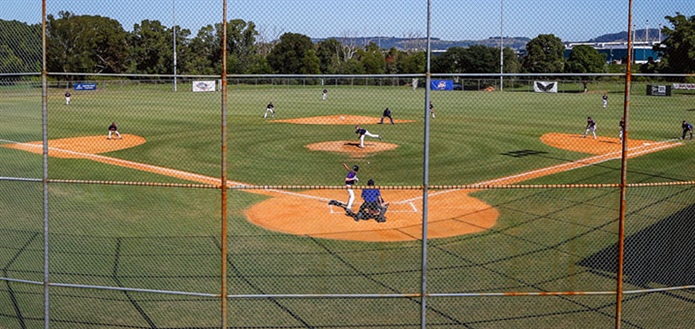
This screenshot has height=329, width=695. Identify the location of pitcher. (361, 132).